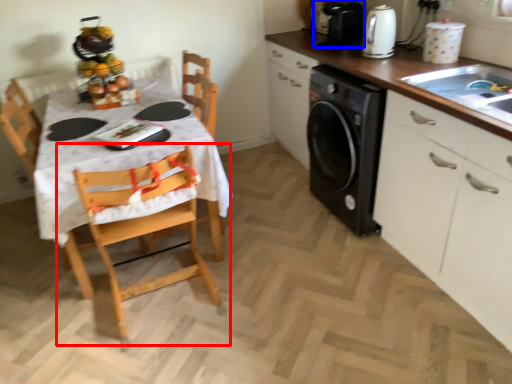
Question: Which object appears farthest to the camera in this image, chair (highlighted by a red box) or appliance (highlighted by a blue box)?

Choices:
 (A) chair
 (B) appliance

Answer: (B)